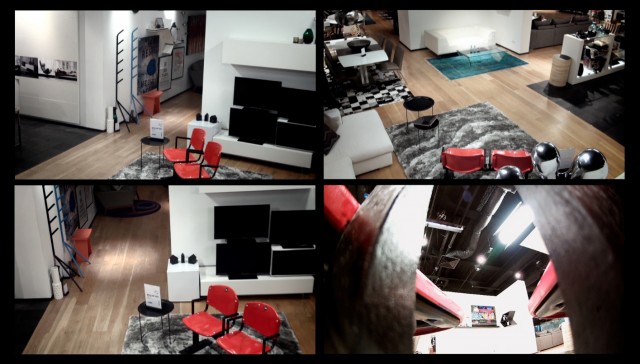
At what (x,y) coordinates should I click in order to perform the action: click on dark blue rug. Please return your answer as a coordinate pair (x, y). The image size is (640, 364). Looking at the image, I should click on (444, 64).